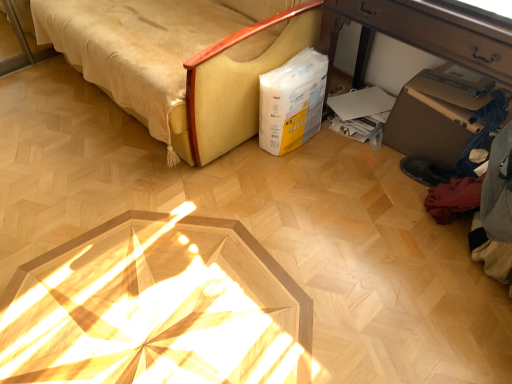
Question: Considering the positions of white paper bag at center-right and brown cardboard box at lower right in the image, is white paper bag at center-right bigger or smaller than brown cardboard box at lower right?

Choices:
 (A) small
 (B) big

Answer: (A)

Question: Considering their positions, is white paper bag at center-right located in front of or behind brown cardboard box at lower right?

Choices:
 (A) behind
 (B) front

Answer: (A)

Question: Based on their relative distances, which object is nearer to the wooden desk at lower right?

Choices:
 (A) brown cardboard box at lower right
 (B) beige fabric sofa at upper left
 (C) white paper bag at center-right

Answer: (C)

Question: Which object is positioned farthest from the brown cardboard box at lower right?

Choices:
 (A) beige fabric sofa at upper left
 (B) white paper bag at center-right
 (C) wooden desk at lower right

Answer: (A)